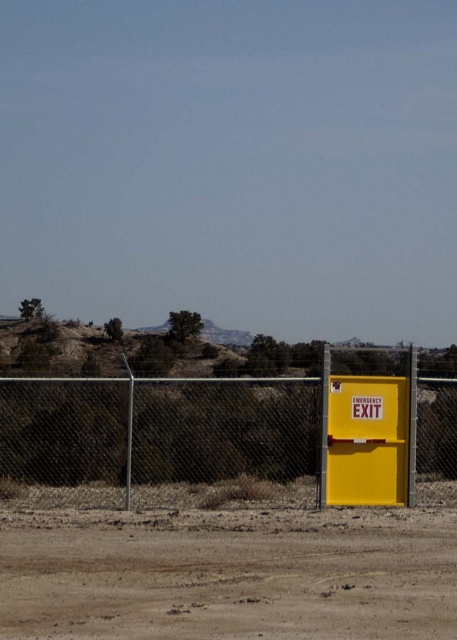
Question: Is dull brown dirt track at lower center smaller than yellow matte emergency exit sign at right?

Choices:
 (A) yes
 (B) no

Answer: (A)

Question: Estimate the real-world distances between objects in this image. Which object is farther from the yellow matte emergency exit sign at right?

Choices:
 (A) metallic chain-link fence at right
 (B) dull brown dirt track at lower center

Answer: (B)

Question: Estimate the real-world distances between objects in this image. Which object is closer to the metallic chain-link fence at right?

Choices:
 (A) yellow matte emergency exit sign at right
 (B) dull brown dirt track at lower center

Answer: (A)

Question: Can you confirm if metallic chain-link fence at right is positioned below yellow matte emergency exit sign at right?

Choices:
 (A) no
 (B) yes

Answer: (A)

Question: Which object is closer to the camera taking this photo?

Choices:
 (A) yellow matte emergency exit sign at right
 (B) metallic chain-link fence at right
 (C) dull brown dirt track at lower center

Answer: (C)

Question: From the image, what is the correct spatial relationship of dull brown dirt track at lower center in relation to yellow matte emergency exit sign at right?

Choices:
 (A) above
 (B) below

Answer: (B)